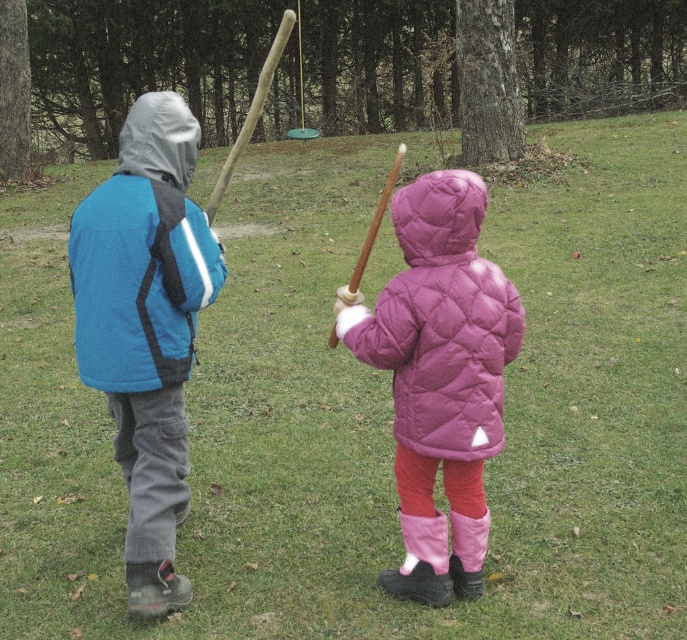
You are a photographer trying to capture a photo of both the blue fleece jacket at left and the wooden baseball bat at upper center in the same frame. Based on their positions, where should you position your camera to ensure both are visible?

The blue fleece jacket at left is located below the wooden baseball bat at upper center, so positioning the camera at a lower angle facing upwards would allow both objects to be captured in the frame.

You are standing at the origin point of the coordinate system, which is the bottom left corner of the image. The blue fleece jacket at left is at point [146,326]. If you want to walk directly to the blue fleece jacket at left, in which direction should you move?

To reach the blue fleece jacket at left located at coordinate point [146,326] from the origin at the bottom left corner, you should move northeast.

You are a parent trying to locate your child who is holding a wooden bat. You see the wooden baseball bat at upper center and the wooden bat at center. Which bat is higher in the image?

The wooden baseball bat at upper center is higher than the wooden bat at center.